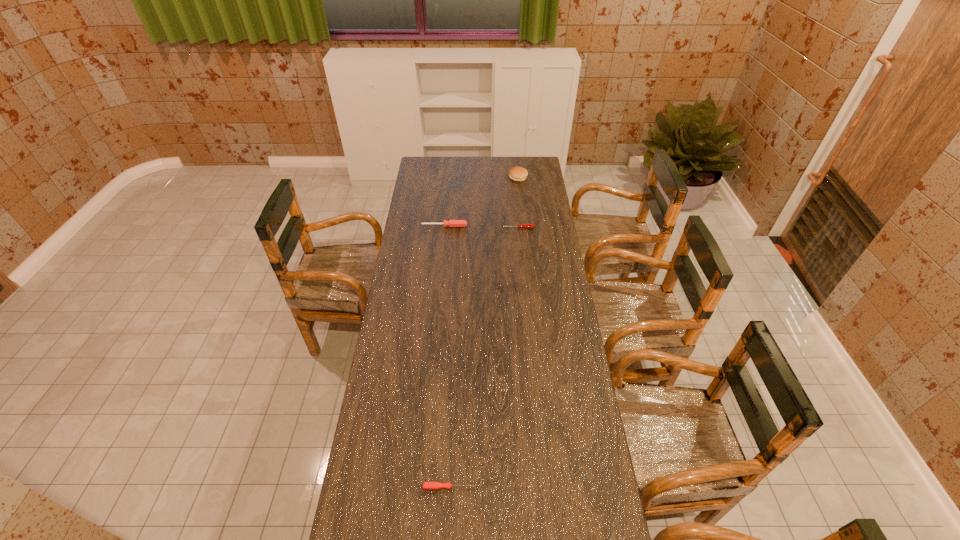
Identify which object is the nearest to the shortest screwdriver. Please provide its 2D coordinates. Your answer should be formatted as a tuple, i.e. [(x, y)], where the tuple contains the x and y coordinates of a point satisfying the conditions above.

[(528, 226)]

Point out which object is positioned as the second nearest to the nearest object. Please provide its 2D coordinates. Your answer should be formatted as a tuple, i.e. [(x, y)], where the tuple contains the x and y coordinates of a point satisfying the conditions above.

[(451, 223)]

Where is `screwdriver that stands as the closest to the tallest object`? screwdriver that stands as the closest to the tallest object is located at coordinates (528, 226).

Locate an element on the screen. Image resolution: width=960 pixels, height=540 pixels. screwdriver that stands as the closest to the tallest object is located at coordinates (528, 226).

Locate an element on the screen. The width and height of the screenshot is (960, 540). free region that satisfies the following two spatial constraints: 1. on the front side of the tallest object; 2. at the tip of the nearest screwdriver is located at coordinates (552, 487).

You are a GUI agent. You are given a task and a screenshot of the screen. Output one action in this format:
    pyautogui.click(x=<x>, y=<y>)
    Task: Click on the free point that satisfies the following two spatial constraints: 1. on the back side of the second tallest object; 2. on the left side of the farthest object
    The height and width of the screenshot is (540, 960).
    Given the screenshot: What is the action you would take?
    pyautogui.click(x=449, y=177)

This screenshot has height=540, width=960. I want to click on blank space that satisfies the following two spatial constraints: 1. on the front side of the second tallest screwdriver; 2. at the tip of the shortest screwdriver, so click(x=543, y=487).

The image size is (960, 540). Find the location of `free region that satisfies the following two spatial constraints: 1. on the front side of the tallest object; 2. at the tip of the nearest screwdriver`. free region that satisfies the following two spatial constraints: 1. on the front side of the tallest object; 2. at the tip of the nearest screwdriver is located at coordinates (552, 487).